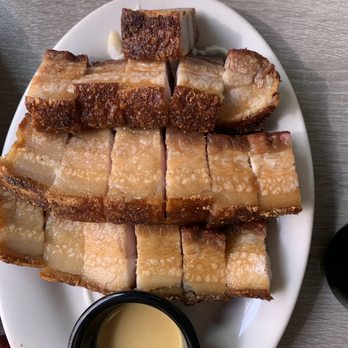
Where is `tabletop`? The image size is (348, 348). tabletop is located at coordinates (316, 43), (25, 28).